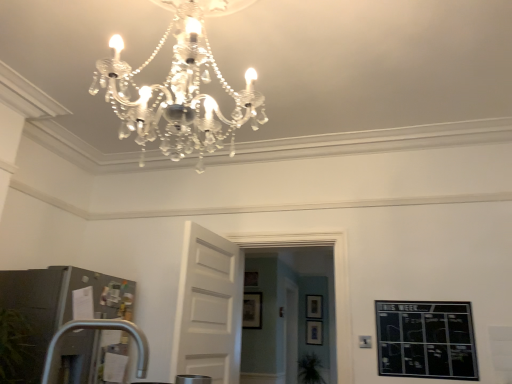
Question: Is wooden picture frame at center, the 4th picture frame viewed from the left, to the left of matte black picture frame at center, the 3th picture frame when ordered from left to right, from the viewer's perspective?

Choices:
 (A) no
 (B) yes

Answer: (A)

Question: Is wooden picture frame at center, the 1th picture frame viewed from the back, wider than matte black picture frame at center, placed as the fourth picture frame when sorted from top to bottom?

Choices:
 (A) yes
 (B) no

Answer: (A)

Question: Is wooden picture frame at center, which appears as the third picture frame when viewed from the top, not within matte black picture frame at center, the second picture frame from the right?

Choices:
 (A) yes
 (B) no

Answer: (A)

Question: Is wooden picture frame at center, placed as the first picture frame when sorted from right to left, touching matte black picture frame at center, marked as the third picture frame in a front-to-back arrangement?

Choices:
 (A) no
 (B) yes

Answer: (A)

Question: From a real-world perspective, does wooden picture frame at center, positioned as the second picture frame in bottom-to-top order, stand above matte black picture frame at center, placed as the fourth picture frame when sorted from top to bottom?

Choices:
 (A) yes
 (B) no

Answer: (A)

Question: Considering the relative sizes of wooden picture frame at center, the 4th picture frame viewed from the left, and matte black picture frame at center, placed as the fourth picture frame when sorted from top to bottom, in the image provided, is wooden picture frame at center, the 4th picture frame viewed from the left, bigger than matte black picture frame at center, placed as the fourth picture frame when sorted from top to bottom,?

Choices:
 (A) no
 (B) yes

Answer: (A)

Question: Is green leafy plant at lower center smaller than wooden picture frame at center, which is counted as the 1th picture frame, starting from the top?

Choices:
 (A) no
 (B) yes

Answer: (A)

Question: Is green leafy plant at lower center oriented towards wooden picture frame at center, the second picture frame positioned from the front?

Choices:
 (A) no
 (B) yes

Answer: (A)

Question: Is green leafy plant at lower center further to camera compared to wooden picture frame at center, which appears as the 3th picture frame when viewed from the back?

Choices:
 (A) no
 (B) yes

Answer: (B)

Question: Is green leafy plant at lower center turned away from wooden picture frame at center, acting as the first picture frame starting from the left?

Choices:
 (A) no
 (B) yes

Answer: (A)

Question: From the image's perspective, is green leafy plant at lower center beneath wooden picture frame at center, marked as the 4th picture frame in a bottom-to-top arrangement?

Choices:
 (A) yes
 (B) no

Answer: (A)

Question: From the image's perspective, is green leafy plant at lower center on top of wooden picture frame at center, acting as the first picture frame starting from the left?

Choices:
 (A) yes
 (B) no

Answer: (B)

Question: Considering the relative sizes of matte black picture frame at center, the 3th picture frame when ordered from left to right, and white wooden door at center in the image provided, is matte black picture frame at center, the 3th picture frame when ordered from left to right, thinner than white wooden door at center?

Choices:
 (A) yes
 (B) no

Answer: (A)